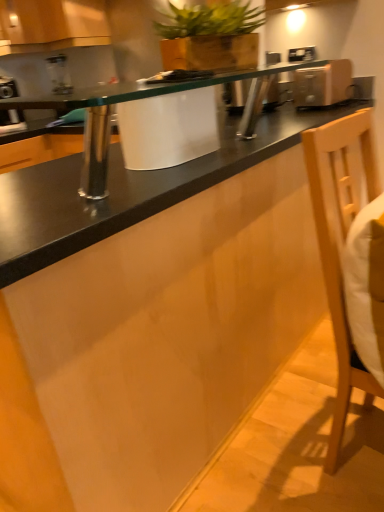
Question: From the image's perspective, is wooden cabinet at upper left located above or below light wood swivel chair at right?

Choices:
 (A) above
 (B) below

Answer: (A)

Question: In terms of width, does wooden cabinet at upper left look wider or thinner when compared to light wood swivel chair at right?

Choices:
 (A) wide
 (B) thin

Answer: (A)

Question: Which of these objects is positioned farthest from the wooden planter at upper center?

Choices:
 (A) metallic silver toaster at upper left, the second appliance positioned from the front
 (B) satin gold toaster at upper right, the 1th appliance viewed from the front
 (C) wooden cabinet at upper left
 (D) black glass countertop at center
 (E) light wood swivel chair at right

Answer: (E)

Question: Which of these objects is positioned closest to the wooden cabinet at upper left?

Choices:
 (A) satin gold toaster at upper right, the 1th appliance from the right
 (B) metallic silver toaster at upper left, which ranks as the second appliance in right-to-left order
 (C) wooden planter at upper center
 (D) black glass countertop at center
 (E) light wood swivel chair at right

Answer: (B)